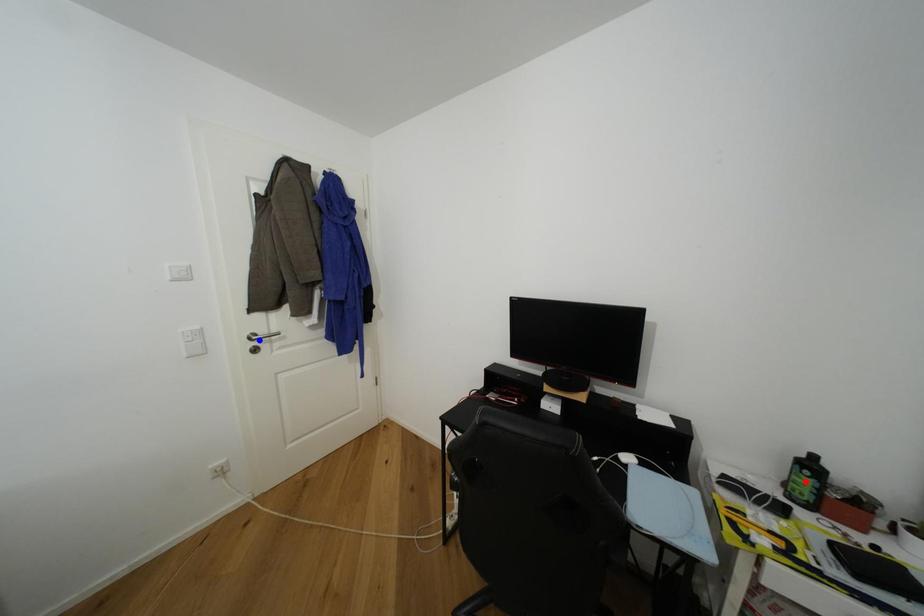
Question: In the image, two points are highlighted. Which point is nearer to the camera? Reply with the corresponding letter.

Choices:
 (A) blue point
 (B) red point

Answer: (B)